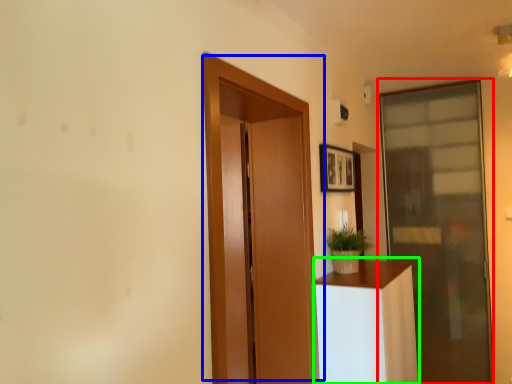
Question: Considering the real-world distances, which object is farthest from door (highlighted by a red box)? door (highlighted by a blue box) or furniture (highlighted by a green box)?

Choices:
 (A) door
 (B) furniture

Answer: (A)